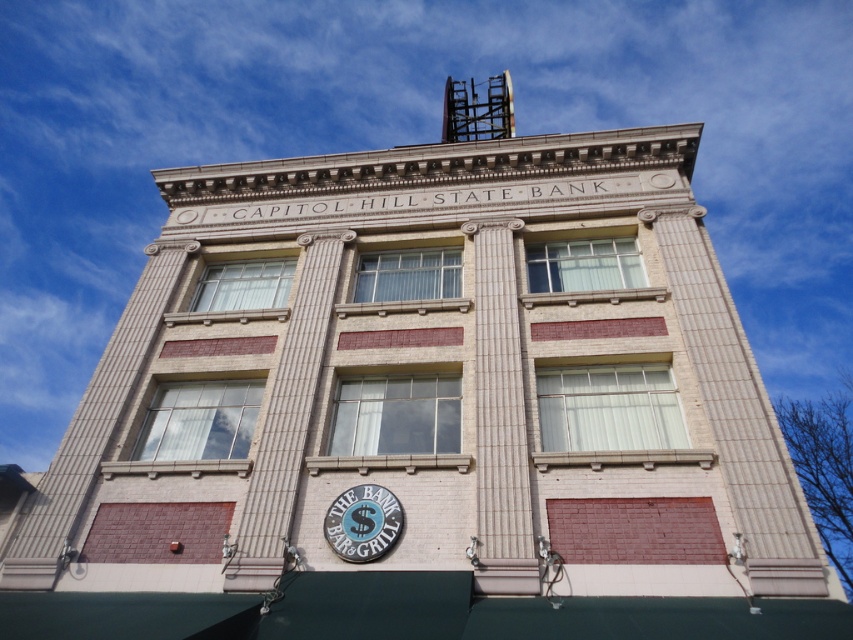
Question: Which object is closer to the camera taking this photo?

Choices:
 (A) smooth stone column at center
 (B) blue metallic sign at lower center
 (C) white marble pillar at center

Answer: (A)

Question: Does white marble pillar at center have a greater width compared to blue metallic sign at lower center?

Choices:
 (A) yes
 (B) no

Answer: (A)

Question: Which point is farther from the camera taking this photo?

Choices:
 (A) (286, 532)
 (B) (486, 404)
 (C) (341, 506)

Answer: (B)

Question: Which point is farther to the camera?

Choices:
 (A) smooth stone column at center
 (B) blue metallic sign at lower center
 (C) white marble pillar at center

Answer: (B)

Question: From the image, what is the correct spatial relationship of smooth stone column at center in relation to blue metallic sign at lower center?

Choices:
 (A) right
 (B) left

Answer: (A)

Question: Is white marble pillar at center bigger than blue metallic sign at lower center?

Choices:
 (A) no
 (B) yes

Answer: (B)